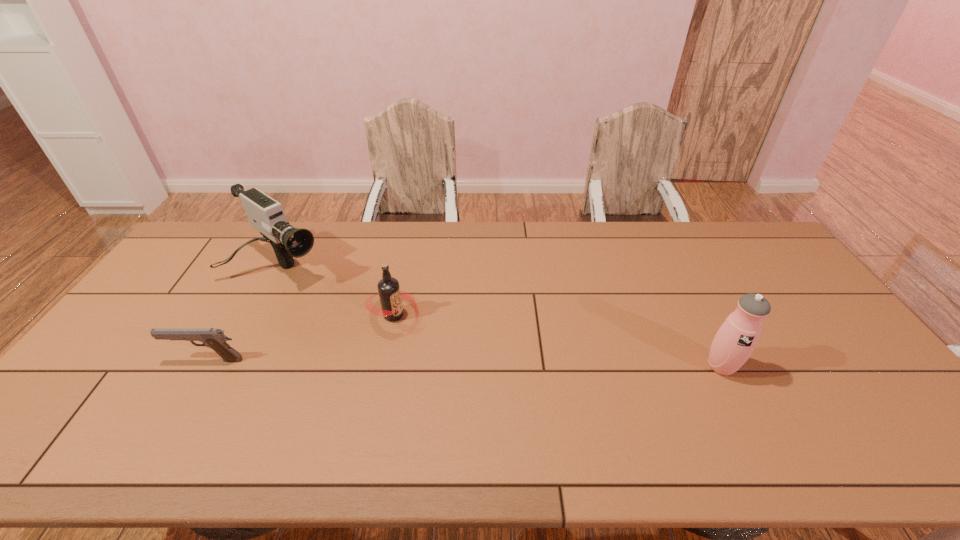
The width and height of the screenshot is (960, 540). I want to click on pistol, so click(x=215, y=339).

Where is `the rightmost object`? This screenshot has height=540, width=960. the rightmost object is located at coordinates (734, 342).

At what (x,y) coordinates should I click in order to perform the action: click on the third object from left to right. Please return your answer as a coordinate pair (x, y). Image resolution: width=960 pixels, height=540 pixels. Looking at the image, I should click on (389, 292).

Where is `root beer`? Image resolution: width=960 pixels, height=540 pixels. root beer is located at coordinates (389, 292).

This screenshot has height=540, width=960. Identify the location of camcorder. pyautogui.click(x=265, y=214).

Locate an element on the screen. vacant space located 0.190m at the barrel of the shortest object is located at coordinates (101, 360).

Identify the location of free space located 0.060m at the barrel of the shortest object. The height and width of the screenshot is (540, 960). (149, 360).

The height and width of the screenshot is (540, 960). I want to click on vacant space located at the barrel of the shortest object, so click(x=115, y=360).

Locate an element on the screen. vacant area situated 0.120m on the back of the rightmost object is located at coordinates (698, 321).

You are a GUI agent. You are given a task and a screenshot of the screen. Output one action in this format:
    pyautogui.click(x=<x>, y=<y>)
    Task: Click on the free space located 0.180m on the label of the second farthest object
    Image resolution: width=960 pixels, height=540 pixels.
    Given the screenshot: What is the action you would take?
    pyautogui.click(x=460, y=360)